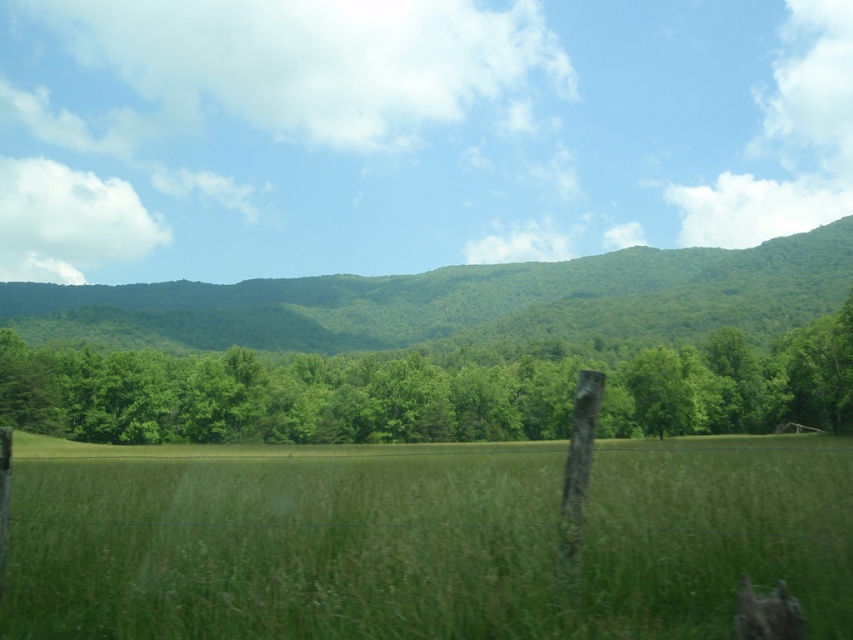
Who is positioned more to the right, green grassy field at center or green leafy tree at center?

green grassy field at center is more to the right.

Can you confirm if green grassy field at center is positioned to the right of green leafy tree at center?

Indeed, green grassy field at center is positioned on the right side of green leafy tree at center.

Where is `green grassy field at center`? Image resolution: width=853 pixels, height=640 pixels. green grassy field at center is located at coordinates (421, 538).

Does green leafy tree at center have a greater height compared to green leafy forest at center?

No.

Is point (701, 365) closer to viewer compared to point (74, 316)?

Yes, it is.

What do you see at coordinates (285, 394) in the screenshot? Image resolution: width=853 pixels, height=640 pixels. I see `green leafy tree at center` at bounding box center [285, 394].

Locate an element on the screen. The image size is (853, 640). green leafy tree at center is located at coordinates (285, 394).

Which of these two, green grassy field at center or green leafy forest at center, stands taller?

Standing taller between the two is green leafy forest at center.

The width and height of the screenshot is (853, 640). In order to click on green grassy field at center in this screenshot , I will do click(x=421, y=538).

You are a GUI agent. You are given a task and a screenshot of the screen. Output one action in this format:
    pyautogui.click(x=<x>, y=<y>)
    Task: Click on the green grassy field at center
    This screenshot has width=853, height=640.
    Given the screenshot: What is the action you would take?
    pyautogui.click(x=421, y=538)